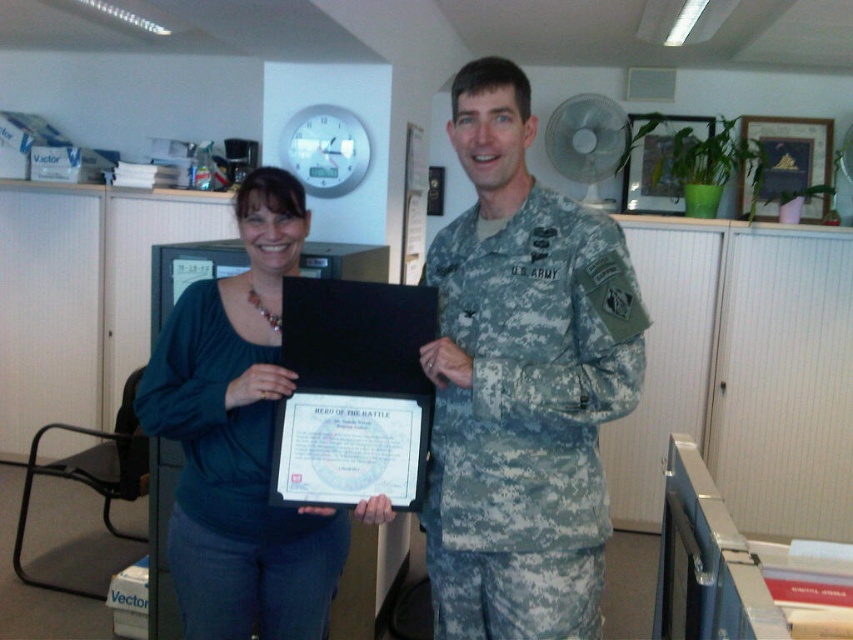
You are an office worker standing at the entrance of the room. You need to locate the camouflage uniform at center. Where should you look in the room?

The camouflage uniform at center is located at the coordinates point [521,381] in the room.

You are an office worker who needs to hang a small picture frame between the two points labeled point (636, 404) and point (199, 422) in the office. Which point should you choose to ensure the frame is closer to the viewer?

Point (636, 404) is closer to the viewer than point (199, 422), so you should choose point (636, 404) to hang the frame closer to the viewer.

You are a photographer setting up for a group photo. You need to arrange the camouflage uniform at center and the teal fabric shirt at center so that both subjects are visible in the frame. Given their height difference, which subject should you place closer to the camera to ensure their faces are equally visible?

The camouflage uniform at center is much taller than the teal fabric shirt at center. To make their faces equally visible, place the teal fabric shirt at center closer to the camera since they are shorter.